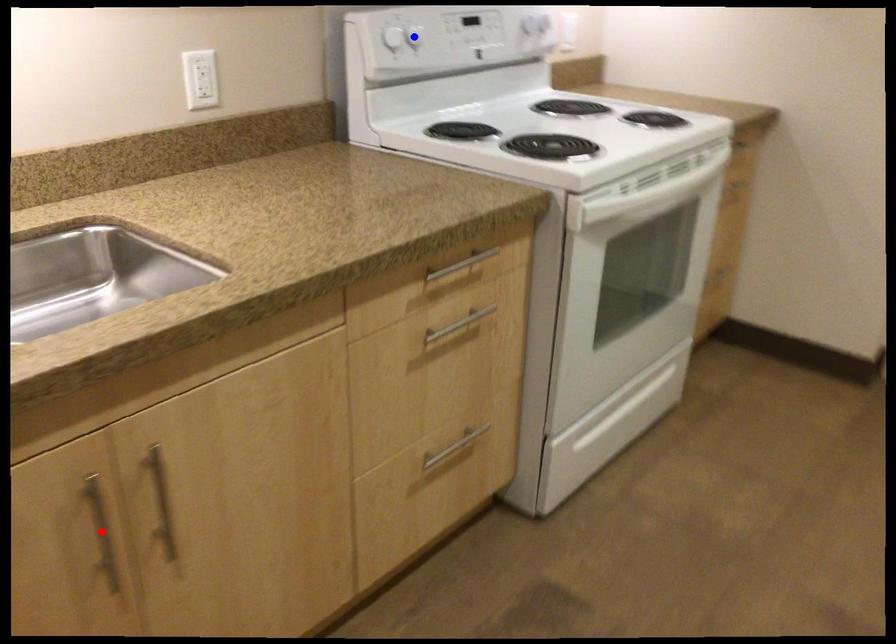
Question: Two points are marked on the image. Which point is closer to the camera?

Choices:
 (A) Blue point is closer.
 (B) Red point is closer.

Answer: (B)